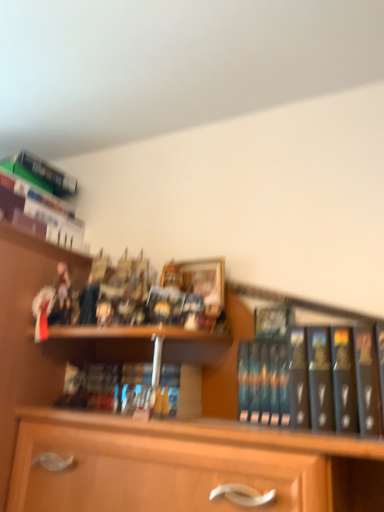
Describe the element at coordinates (134, 389) in the screenshot. The image size is (384, 512). I see `hardcover books at center, positioned as the 1th book in bottom-to-top order` at that location.

The width and height of the screenshot is (384, 512). Find the location of `black matte book at right, the 3th book in the back-to-front sequence`. black matte book at right, the 3th book in the back-to-front sequence is located at coordinates (313, 377).

Describe the element at coordinates (46, 197) in the screenshot. The width and height of the screenshot is (384, 512). I see `hardcover book at upper left, acting as the 1th book starting from the left` at that location.

At what (x,y) coordinates should I click in order to perform the action: click on wooden figurines at left. Please return your answer as a coordinate pair (x, y). Image resolution: width=384 pixels, height=512 pixels. Looking at the image, I should click on (27, 334).

In the scene shown: Is hardcover books at center, which is the 3th book in top-to-bottom order, to the right of black matte book at right, placed as the first book when sorted from right to left, from the viewer's perspective?

No.

This screenshot has width=384, height=512. There is a hardcover books at center, the second book when ordered from back to front. What are the coordinates of `the 1st book above it (from a real-world perspective)` in the screenshot? It's located at (313, 377).

Who is more distant, hardcover books at center, positioned as the 1th book in bottom-to-top order, or black matte book at right, the 1th book when ordered from front to back?

hardcover books at center, positioned as the 1th book in bottom-to-top order, is more distant.

How different are the orientations of hardcover books at center, the second book in the front-to-back sequence, and black matte book at right, placed as the first book when sorted from right to left, in degrees?

0.693 degrees.

Consider the image. In terms of height, does hardcover book at upper left, which is counted as the third book, starting from the front, look taller or shorter compared to hardcover books at center, positioned as the 1th book in bottom-to-top order?

In the image, hardcover book at upper left, which is counted as the third book, starting from the front, appears to be taller than hardcover books at center, positioned as the 1th book in bottom-to-top order.

You are a GUI agent. You are given a task and a screenshot of the screen. Output one action in this format:
    pyautogui.click(x=<x>, y=<y>)
    Task: Click on the book that is on the left side of hardcover books at center, the second book when ordered from back to front
    This screenshot has height=512, width=384.
    Given the screenshot: What is the action you would take?
    pyautogui.click(x=46, y=197)

Is hardcover book at upper left, acting as the 1th book starting from the left, not close to hardcover books at center, positioned as the 1th book in bottom-to-top order?

That's not correct — hardcover book at upper left, acting as the 1th book starting from the left, is a little close to hardcover books at center, positioned as the 1th book in bottom-to-top order.

Can you confirm if black matte book at right, the second book positioned from the top, is positioned to the right of hardcover book at upper left, which is counted as the third book, starting from the front?

Yes, black matte book at right, the second book positioned from the top, is to the right of hardcover book at upper left, which is counted as the third book, starting from the front.

Is black matte book at right, the second book positioned from the top, oriented away from hardcover book at upper left, positioned as the 1th book in back-to-front order?

No, black matte book at right, the second book positioned from the top, is not facing the opposite direction of hardcover book at upper left, positioned as the 1th book in back-to-front order.

From a real-world perspective, is black matte book at right, which is the 2th book from bottom to top, over hardcover book at upper left, positioned as the 1th book in back-to-front order?

Actually, black matte book at right, which is the 2th book from bottom to top, is physically below hardcover book at upper left, positioned as the 1th book in back-to-front order, in the real world.

From the image's perspective, is black matte book at right, the third book from the left, above hardcover book at upper left, which is counted as the third book, starting from the front?

Incorrect, from the image's perspective, black matte book at right, the third book from the left, is lower than hardcover book at upper left, which is counted as the third book, starting from the front.

Could you tell me if black matte book at right, the 3th book in the back-to-front sequence, is turned towards hardcover books at center, which is the 3th book in top-to-bottom order?

No.

How many degrees apart are the facing directions of black matte book at right, placed as the first book when sorted from right to left, and hardcover books at center, the second book when ordered from back to front?

0.693 degrees.

From the image's perspective, between black matte book at right, the 3th book in the back-to-front sequence, and hardcover books at center, which is counted as the second book, starting from the right, which one is located above?

black matte book at right, the 3th book in the back-to-front sequence, is shown above in the image.

The width and height of the screenshot is (384, 512). Identify the location of the 1st book behind when counting from the black matte book at right, the 3th book in the back-to-front sequence. (134, 389).

Could black matte book at right, which is the 2th book from bottom to top, be considered to be inside wooden figurines at left?

No, wooden figurines at left does not contain black matte book at right, which is the 2th book from bottom to top.

What's the angular difference between wooden figurines at left and black matte book at right, the 3th book in the back-to-front sequence,'s facing directions?

The angular difference between wooden figurines at left and black matte book at right, the 3th book in the back-to-front sequence, is 0.0677 degrees.

Between wooden figurines at left and black matte book at right, placed as the first book when sorted from right to left, which one has larger size?

wooden figurines at left is bigger.

From the image's perspective, which object appears higher, wooden figurines at left or black matte book at right, the 3th book in the back-to-front sequence?

black matte book at right, the 3th book in the back-to-front sequence, appears higher in the image.

Which is more to the left, wooden figurines at left or hardcover book at upper left, positioned as the 1th book in back-to-front order?

wooden figurines at left is more to the left.

Can you tell me how much wooden figurines at left and hardcover book at upper left, which is counted as the third book, starting from the front, differ in facing direction?

The facing directions of wooden figurines at left and hardcover book at upper left, which is counted as the third book, starting from the front, are 2.49 degrees apart.

From a real-world perspective, is wooden figurines at left physically above hardcover book at upper left, the third book ordered from the bottom?

No, from a real-world perspective, wooden figurines at left is not above hardcover book at upper left, the third book ordered from the bottom.

Which of these two, wooden figurines at left or hardcover book at upper left, which is counted as the first book, starting from the top, stands shorter?

hardcover book at upper left, which is counted as the first book, starting from the top.

Is hardcover book at upper left, positioned as the 1th book in back-to-front order, oriented towards wooden figurines at left?

No, hardcover book at upper left, positioned as the 1th book in back-to-front order, is not facing towards wooden figurines at left.

From the image's perspective, is hardcover book at upper left, the third book ordered from the bottom, located above wooden figurines at left?

Yes, from the image's perspective, hardcover book at upper left, the third book ordered from the bottom, is above wooden figurines at left.

Which is more to the left, hardcover book at upper left, positioned as the 1th book in back-to-front order, or wooden figurines at left?

From the viewer's perspective, wooden figurines at left appears more on the left side.

From a real-world perspective, starting from the hardcover books at center, which is counted as the second book, starting from the right, which book is the 1st one vertically above it? Please provide its 2D coordinates.

[(313, 377)]

From the image's perspective, starting from the hardcover book at upper left, the third book ordered from the bottom, which book is the 2nd one below? Please provide its 2D coordinates.

[(134, 389)]

Considering their positions, is black matte book at right, which is the 2th book from bottom to top, positioned closer to wooden figurines at left than hardcover book at upper left, which is counted as the first book, starting from the top?

Among the two, hardcover book at upper left, which is counted as the first book, starting from the top, is located nearer to wooden figurines at left.

When comparing their distances from wooden figurines at left, does hardcover book at upper left, the third book ordered from the bottom, or hardcover books at center, the second book when ordered from back to front, seem further?

Based on the image, hardcover book at upper left, the third book ordered from the bottom, appears to be further to wooden figurines at left.

Which object lies nearer to the anchor point hardcover books at center, which is the 3th book in top-to-bottom order, black matte book at right, the third book from the left, or hardcover book at upper left, which is counted as the third book, starting from the front?

black matte book at right, the third book from the left.

Estimate the real-world distances between objects in this image. Which object is closer to black matte book at right, the third book from the left, hardcover book at upper left, which is counted as the third book, starting from the front, or hardcover books at center, the second book from the left?

Among the two, hardcover books at center, the second book from the left, is located nearer to black matte book at right, the third book from the left.

Based on their spatial positions, is wooden figurines at left or hardcover book at upper left, which is the 3th book in right-to-left order, closer to black matte book at right, the third book from the left?

The object closer to black matte book at right, the third book from the left, is wooden figurines at left.

Which object lies nearer to the anchor point hardcover books at center, which is the 3th book in top-to-bottom order, wooden figurines at left or black matte book at right, the 3th book in the back-to-front sequence?

The object closer to hardcover books at center, which is the 3th book in top-to-bottom order, is wooden figurines at left.

Based on their spatial positions, is black matte book at right, the 3th book in the back-to-front sequence, or wooden figurines at left closer to hardcover books at center, which is the 3th book in top-to-bottom order?

wooden figurines at left is positioned closer to the anchor hardcover books at center, which is the 3th book in top-to-bottom order.

Considering their positions, is black matte book at right, the second book positioned from the top, positioned closer to wooden figurines at left than hardcover books at center, the second book from the left?

hardcover books at center, the second book from the left, lies closer to wooden figurines at left than the other object.

Find the location of a particular element. book between hardcover book at upper left, which is counted as the first book, starting from the top, and black matte book at right, which is the 2th book from bottom to top is located at coordinates (134, 389).